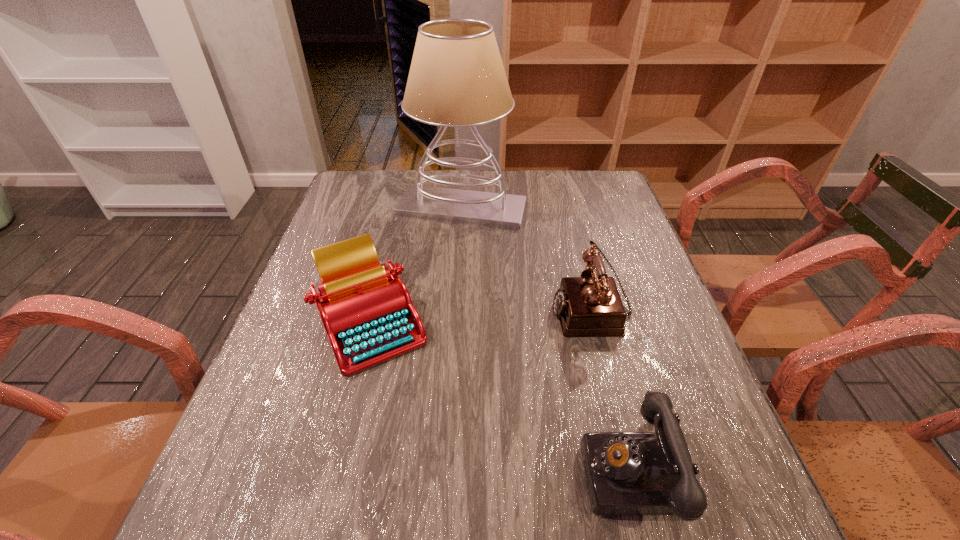
Image resolution: width=960 pixels, height=540 pixels. Identify the location of unoccupied position between the typewriter and the farther telephone. (481, 315).

Find the location of `unoccupied area between the farthest object and the farther telephone`. unoccupied area between the farthest object and the farther telephone is located at coordinates (526, 259).

Locate an element on the screen. This screenshot has height=540, width=960. vacant space that is in between the farther telephone and the typewriter is located at coordinates (481, 315).

Locate an element on the screen. free space between the tallest object and the typewriter is located at coordinates [x=416, y=265].

Identify which object is the nearest to the nearest object. Please provide its 2D coordinates. Your answer should be formatted as a tuple, i.e. [(x, y)], where the tuple contains the x and y coordinates of a point satisfying the conditions above.

[(588, 306)]

At what (x,y) coordinates should I click in order to perform the action: click on object that is the third closest to the table lamp. Please return your answer as a coordinate pair (x, y). Looking at the image, I should click on (628, 473).

Locate an element on the screen. free space that satisfies the following two spatial constraints: 1. on the dial of the farther telephone; 2. on the typing side of the typewriter is located at coordinates (594, 321).

The height and width of the screenshot is (540, 960). I want to click on vacant space that satisfies the following two spatial constraints: 1. on the dial of the farther telephone; 2. on the typing side of the typewriter, so click(x=594, y=321).